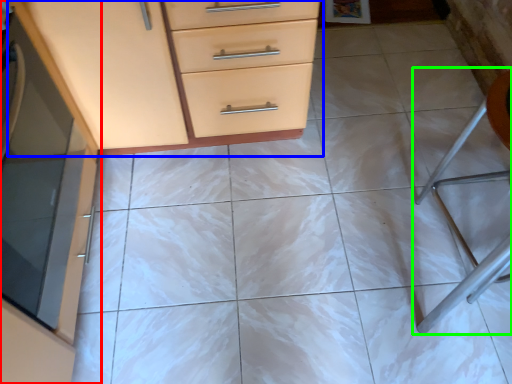
Question: Which object is positioned closest to cabinetry (highlighted by a red box)? Select from chest of drawers (highlighted by a blue box) and folding chair (highlighted by a green box).

Choices:
 (A) chest of drawers
 (B) folding chair

Answer: (A)